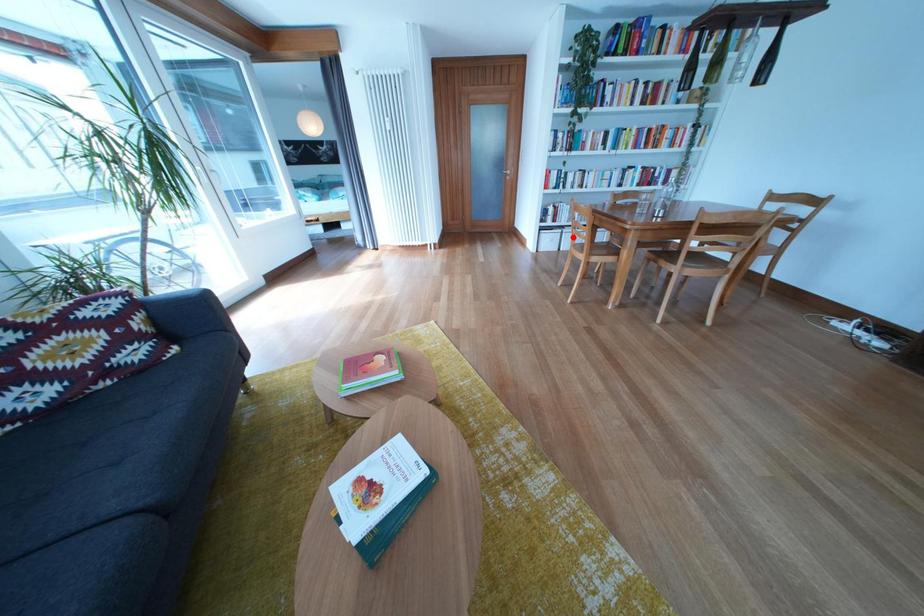
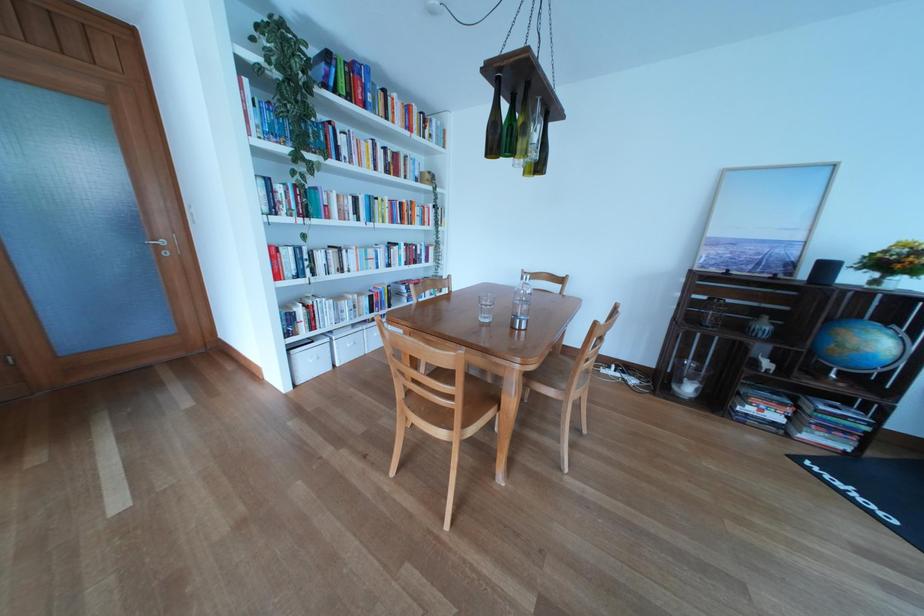
Locate, in the second image, the point that corresponds to the highlighted location in the first image.

(341, 345)